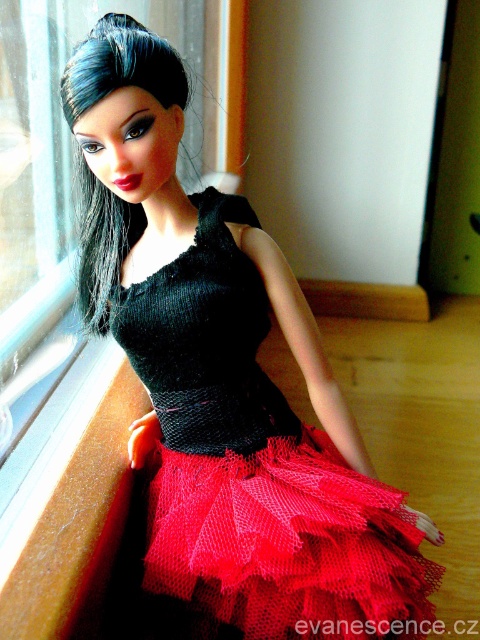
Question: Is red tulle tutu at lower center bigger than transparent glass window at upper left?

Choices:
 (A) no
 (B) yes

Answer: (A)

Question: Is red tulle tutu at lower center positioned before transparent glass window at upper left?

Choices:
 (A) no
 (B) yes

Answer: (A)

Question: Can you confirm if red tulle tutu at lower center is smaller than transparent glass window at upper left?

Choices:
 (A) no
 (B) yes

Answer: (B)